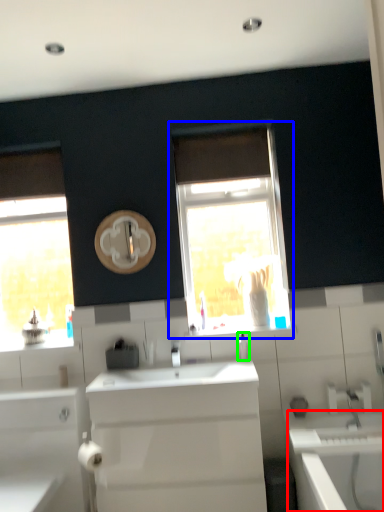
Question: Which is farther away from bath (highlighted by a red box)? window (highlighted by a blue box) or soap dispenser (highlighted by a green box)?

Choices:
 (A) window
 (B) soap dispenser

Answer: (A)